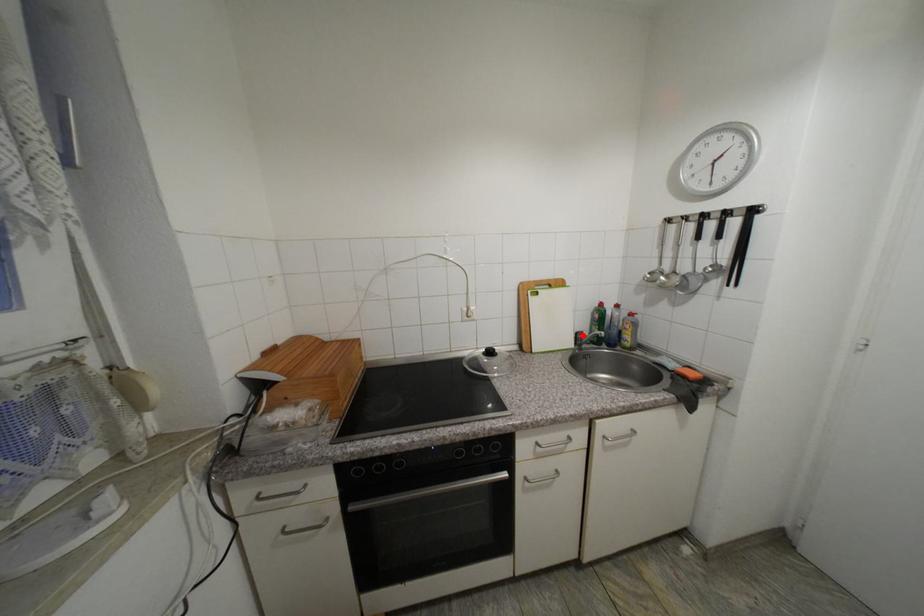
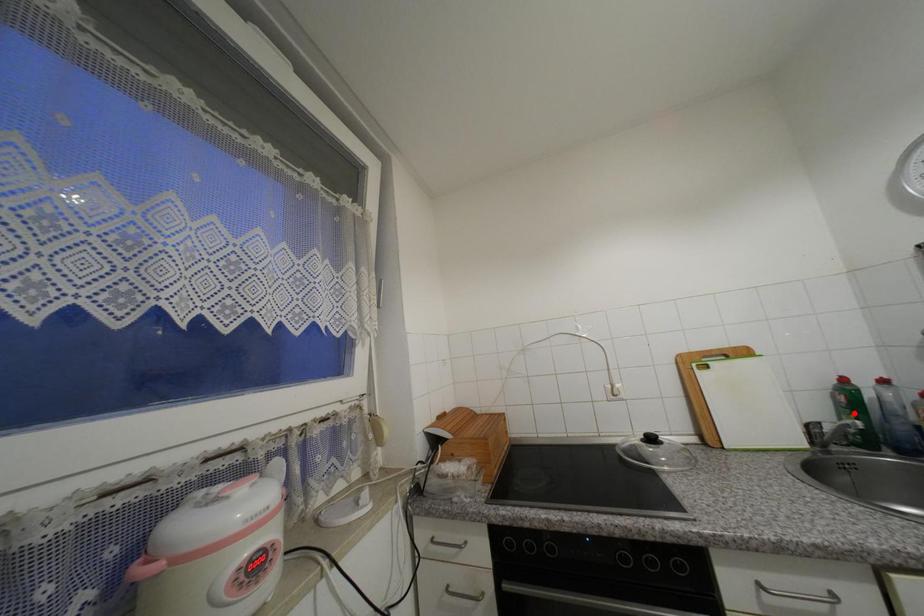
I am providing you with two images of the same scene from different viewpoints. A red point is marked on the first image and another point is marked on the second image. Is the red point in image1 aligned with the point shown in image2?

No